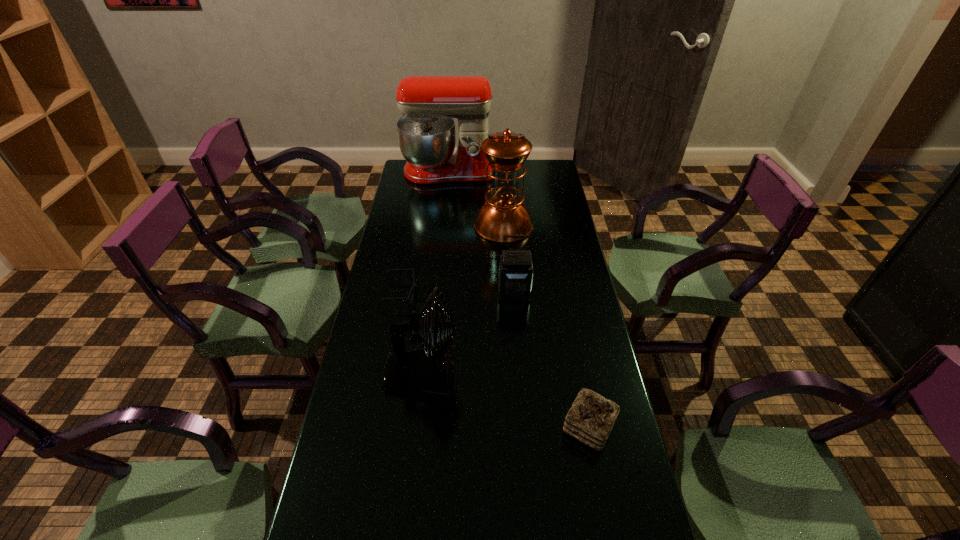
You are a GUI agent. You are given a task and a screenshot of the screen. Output one action in this format:
    pyautogui.click(x=<x>, y=<y>)
    Task: Click on the vacant space positioned 0.180m on the front of the chocolate cake
    This screenshot has height=540, width=960.
    Given the screenshot: What is the action you would take?
    pyautogui.click(x=609, y=532)

Where is `vacant space located on the front-facing side of the spectacles`? vacant space located on the front-facing side of the spectacles is located at coordinates (497, 293).

At what (x,y) coordinates should I click in order to perform the action: click on object situated at the far edge. Please return your answer as a coordinate pair (x, y). Looking at the image, I should click on (426, 133).

Locate an element on the screen. mixer present at the left edge is located at coordinates (426, 133).

Where is `fan located at the left edge`? fan located at the left edge is located at coordinates (429, 371).

Identify the location of spectacles situated at the left edge. The width and height of the screenshot is (960, 540). pyautogui.click(x=414, y=285).

Identify the location of oil lamp positioned at the right edge. (502, 214).

You are a GUI agent. You are given a task and a screenshot of the screen. Output one action in this format:
    pyautogui.click(x=<x>, y=<y>)
    Task: Click on the chocolate cake present at the right edge
    
    Given the screenshot: What is the action you would take?
    pyautogui.click(x=591, y=418)

At what (x,y) coordinates should I click in order to perform the action: click on object located at the far left corner. Please return your answer as a coordinate pair (x, y). The width and height of the screenshot is (960, 540). Looking at the image, I should click on (426, 133).

In the image, there is a desktop. What are the coordinates of `vacant space at the left edge` in the screenshot? It's located at (426, 211).